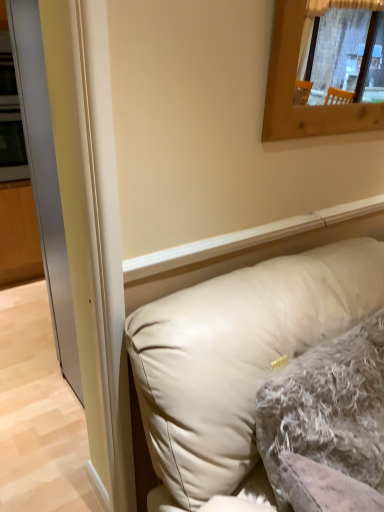
Find the location of a particular element. The image size is (384, 512). fuzzy gray pillow at center, the first pillow in the back-to-front sequence is located at coordinates (327, 409).

Locate an element on the screen. Image resolution: width=384 pixels, height=512 pixels. beige leather pillow at lower right, positioned as the 1th pillow in front-to-back order is located at coordinates (237, 355).

What is the approximate width of transparent glass door at left?

It is 3.71 inches.

At what (x,y) coordinates should I click in order to perform the action: click on fuzzy gray pillow at center, the 2th pillow positioned from the front. Please return your answer as a coordinate pair (x, y). The height and width of the screenshot is (512, 384). Looking at the image, I should click on (327, 409).

Is transparent glass door at left located within fuzzy gray pillow at center, the 2th pillow positioned from the front?

Actually, transparent glass door at left is outside fuzzy gray pillow at center, the 2th pillow positioned from the front.

From the image's perspective, between fuzzy gray pillow at center, the first pillow in the back-to-front sequence, and transparent glass door at left, which one is located above?

transparent glass door at left is shown above in the image.

In the image, is fuzzy gray pillow at center, the 2th pillow positioned from the front, positioned in front of or behind transparent glass door at left?

Clearly, fuzzy gray pillow at center, the 2th pillow positioned from the front, is behind transparent glass door at left.

Which is more to the left, fuzzy gray pillow at center, the 2th pillow positioned from the front, or beige leather pillow at lower right, positioned as the 1th pillow in front-to-back order?

beige leather pillow at lower right, positioned as the 1th pillow in front-to-back order.

From the image's perspective, which one is positioned higher, fuzzy gray pillow at center, the first pillow in the back-to-front sequence, or beige leather pillow at lower right, the second pillow in the back-to-front sequence?

fuzzy gray pillow at center, the first pillow in the back-to-front sequence, is shown above in the image.

Does beige leather pillow at lower right, positioned as the 1th pillow in front-to-back order, have a greater width compared to fuzzy gray pillow at center, the 2th pillow positioned from the front?

Yes.

Which is more to the right, beige leather pillow at lower right, positioned as the 1th pillow in front-to-back order, or fuzzy gray pillow at center, the first pillow in the back-to-front sequence?

From the viewer's perspective, fuzzy gray pillow at center, the first pillow in the back-to-front sequence, appears more on the right side.

In terms of size, does beige leather pillow at lower right, the second pillow in the back-to-front sequence, appear bigger or smaller than fuzzy gray pillow at center, the first pillow in the back-to-front sequence?

Clearly, beige leather pillow at lower right, the second pillow in the back-to-front sequence, is larger in size than fuzzy gray pillow at center, the first pillow in the back-to-front sequence.

From a real-world perspective, does beige leather pillow at lower right, positioned as the 1th pillow in front-to-back order, stand above fuzzy gray pillow at center, the 2th pillow positioned from the front?

Actually, beige leather pillow at lower right, positioned as the 1th pillow in front-to-back order, is physically below fuzzy gray pillow at center, the 2th pillow positioned from the front, in the real world.

Is point (64, 262) positioned in front of point (310, 265)?

That is False.

Does transparent glass door at left touch beige leather pillow at lower right, the second pillow in the back-to-front sequence?

No, transparent glass door at left is not with beige leather pillow at lower right, the second pillow in the back-to-front sequence.

Can you confirm if transparent glass door at left is wider than beige leather pillow at lower right, positioned as the 1th pillow in front-to-back order?

No.

Who is bigger, transparent glass door at left or beige leather pillow at lower right, positioned as the 1th pillow in front-to-back order?

beige leather pillow at lower right, positioned as the 1th pillow in front-to-back order, is bigger.

Is beige leather pillow at lower right, the second pillow in the back-to-front sequence, positioned far away from transparent glass door at left?

They are positioned close to each other.

Is beige leather pillow at lower right, the second pillow in the back-to-front sequence, completely or partially outside of transparent glass door at left?

beige leather pillow at lower right, the second pillow in the back-to-front sequence, lies outside transparent glass door at left's area.

Considering the sizes of objects beige leather pillow at lower right, positioned as the 1th pillow in front-to-back order, and transparent glass door at left in the image provided, who is shorter, beige leather pillow at lower right, positioned as the 1th pillow in front-to-back order, or transparent glass door at left?

beige leather pillow at lower right, positioned as the 1th pillow in front-to-back order, is shorter.

Based on the photo, from a real-world perspective, is beige leather pillow at lower right, the second pillow in the back-to-front sequence, on transparent glass door at left?

No, from a real-world perspective, beige leather pillow at lower right, the second pillow in the back-to-front sequence, is not on top of transparent glass door at left.

Looking at this image, which is closer, (x=54, y=234) or (x=324, y=450)?

Point (x=54, y=234) appears to be farther away from the viewer than point (x=324, y=450).

Is transparent glass door at left to the left or to the right of fuzzy gray pillow at center, the first pillow in the back-to-front sequence, in the image?

Based on their positions, transparent glass door at left is located to the left of fuzzy gray pillow at center, the first pillow in the back-to-front sequence.

From a real-world perspective, is transparent glass door at left under fuzzy gray pillow at center, the first pillow in the back-to-front sequence?

No, from a real-world perspective, transparent glass door at left is not under fuzzy gray pillow at center, the first pillow in the back-to-front sequence.

Considering the sizes of objects transparent glass door at left and fuzzy gray pillow at center, the first pillow in the back-to-front sequence, in the image provided, who is smaller, transparent glass door at left or fuzzy gray pillow at center, the first pillow in the back-to-front sequence,?

transparent glass door at left is smaller.

Locate an element on the screen. the 2nd pillow to the right of the transparent glass door at left, starting your count from the anchor is located at coordinates (327, 409).

Image resolution: width=384 pixels, height=512 pixels. Find the location of `pillow located in front of the fuzzy gray pillow at center, the 2th pillow positioned from the front`. pillow located in front of the fuzzy gray pillow at center, the 2th pillow positioned from the front is located at coordinates (237, 355).

Based on their spatial positions, is fuzzy gray pillow at center, the 2th pillow positioned from the front, or transparent glass door at left closer to beige leather pillow at lower right, positioned as the 1th pillow in front-to-back order?

fuzzy gray pillow at center, the 2th pillow positioned from the front, lies closer to beige leather pillow at lower right, positioned as the 1th pillow in front-to-back order, than the other object.

When comparing their distances from fuzzy gray pillow at center, the 2th pillow positioned from the front, does beige leather pillow at lower right, the second pillow in the back-to-front sequence, or transparent glass door at left seem further?

Based on the image, transparent glass door at left appears to be further to fuzzy gray pillow at center, the 2th pillow positioned from the front.

When comparing their distances from transparent glass door at left, does fuzzy gray pillow at center, the 2th pillow positioned from the front, or beige leather pillow at lower right, positioned as the 1th pillow in front-to-back order, seem closer?

beige leather pillow at lower right, positioned as the 1th pillow in front-to-back order, lies closer to transparent glass door at left than the other object.

When comparing their distances from beige leather pillow at lower right, the second pillow in the back-to-front sequence, does transparent glass door at left or fuzzy gray pillow at center, the 2th pillow positioned from the front, seem further?

transparent glass door at left is further to beige leather pillow at lower right, the second pillow in the back-to-front sequence.

Considering their positions, is beige leather pillow at lower right, positioned as the 1th pillow in front-to-back order, positioned further to transparent glass door at left than fuzzy gray pillow at center, the 2th pillow positioned from the front?

fuzzy gray pillow at center, the 2th pillow positioned from the front, is positioned further to the anchor transparent glass door at left.

Considering their positions, is transparent glass door at left positioned closer to fuzzy gray pillow at center, the first pillow in the back-to-front sequence, than beige leather pillow at lower right, positioned as the 1th pillow in front-to-back order?

beige leather pillow at lower right, positioned as the 1th pillow in front-to-back order, is closer to fuzzy gray pillow at center, the first pillow in the back-to-front sequence.

I want to click on pillow between transparent glass door at left and fuzzy gray pillow at center, the 2th pillow positioned from the front, in the horizontal direction, so click(x=237, y=355).